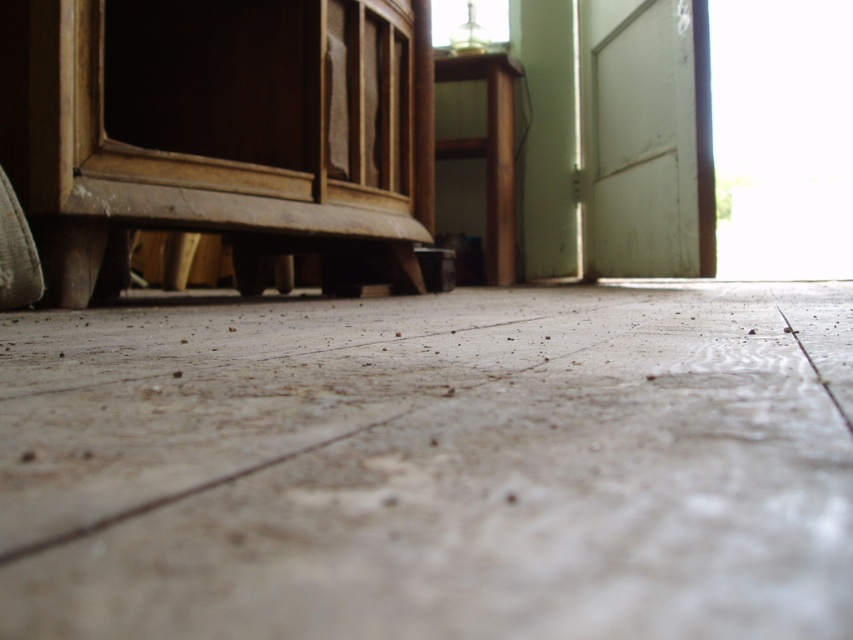
Question: Which point is farther to the camera?

Choices:
 (A) (495, 150)
 (B) (65, 195)

Answer: (A)

Question: Does wooden dresser at left have a larger size compared to wooden stool at center?

Choices:
 (A) no
 (B) yes

Answer: (B)

Question: Is wooden dresser at left below wooden stool at center?

Choices:
 (A) yes
 (B) no

Answer: (A)

Question: Is wooden dresser at left thinner than wooden stool at center?

Choices:
 (A) no
 (B) yes

Answer: (A)

Question: Which point appears closest to the camera in this image?

Choices:
 (A) (489, 284)
 (B) (361, 100)

Answer: (B)

Question: Which point appears farthest from the camera in this image?

Choices:
 (A) (490, 84)
 (B) (277, 113)

Answer: (A)